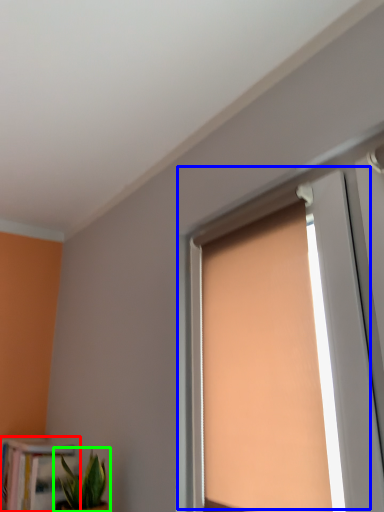
Question: Which object is positioned closest to bookcase (highlighted by a red box)? Select from window (highlighted by a blue box) and houseplant (highlighted by a green box).

Choices:
 (A) window
 (B) houseplant

Answer: (B)